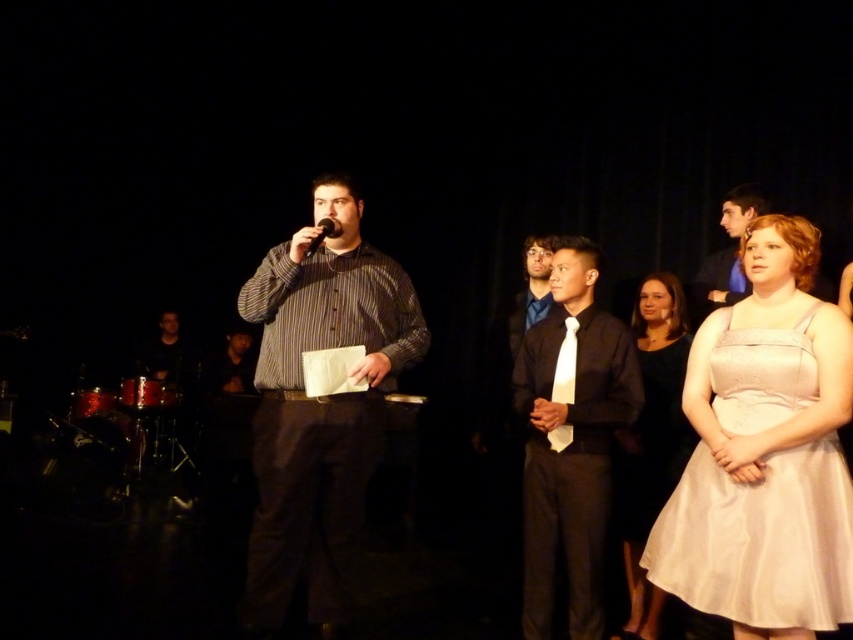
Question: Which point is closer to the camera?

Choices:
 (A) (165, 360)
 (B) (572, 369)
 (C) (315, 248)

Answer: (C)

Question: Can you confirm if satin white dress at right is positioned below matte blue shirt at center?

Choices:
 (A) no
 (B) yes

Answer: (B)

Question: Which point is farther from the camera taking this photo?

Choices:
 (A) (718, 273)
 (B) (672, 301)

Answer: (A)

Question: Can you confirm if satin white dress at right is positioned to the left of metallic silver microphone at center?

Choices:
 (A) yes
 (B) no

Answer: (B)

Question: Which point appears farthest from the camera in this image?

Choices:
 (A) (292, 493)
 (B) (625, 444)
 (C) (523, 305)
 (D) (177, 312)

Answer: (D)

Question: Considering the relative positions of black satin shirt at center and metallic silver microphone at center in the image provided, where is black satin shirt at center located with respect to metallic silver microphone at center?

Choices:
 (A) above
 (B) below

Answer: (B)